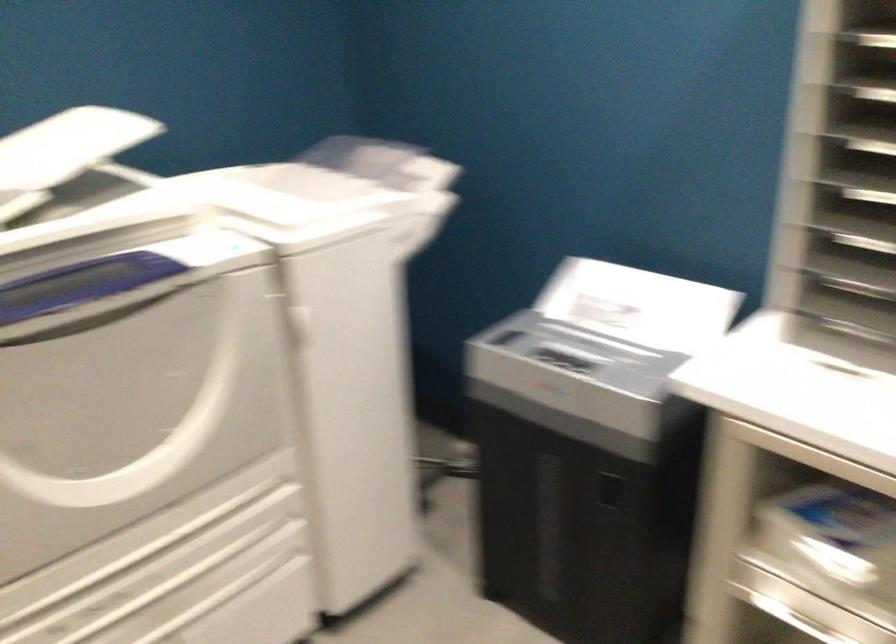
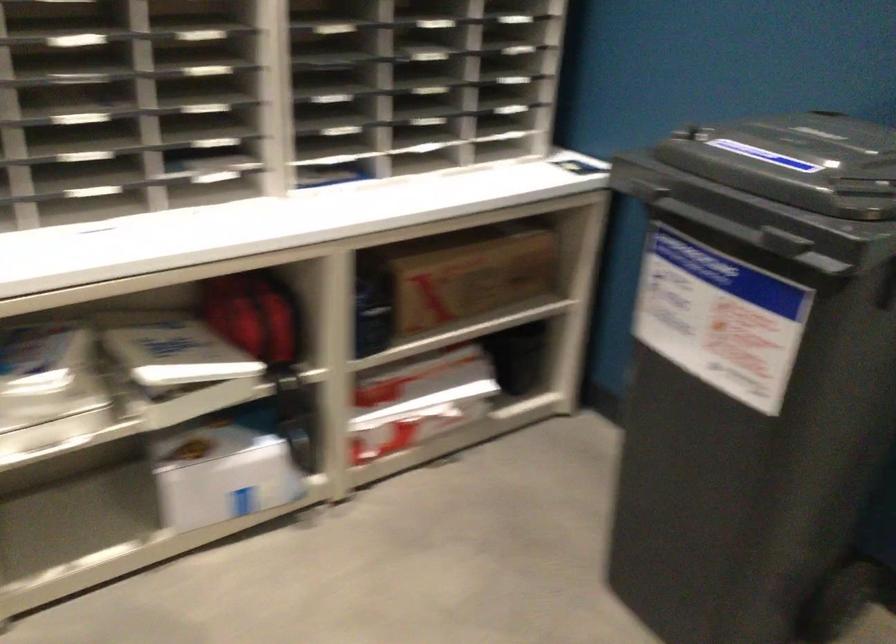
The images are taken continuously from a first-person perspective. In which direction is your viewpoint rotating?

The camera rotated toward right-down.